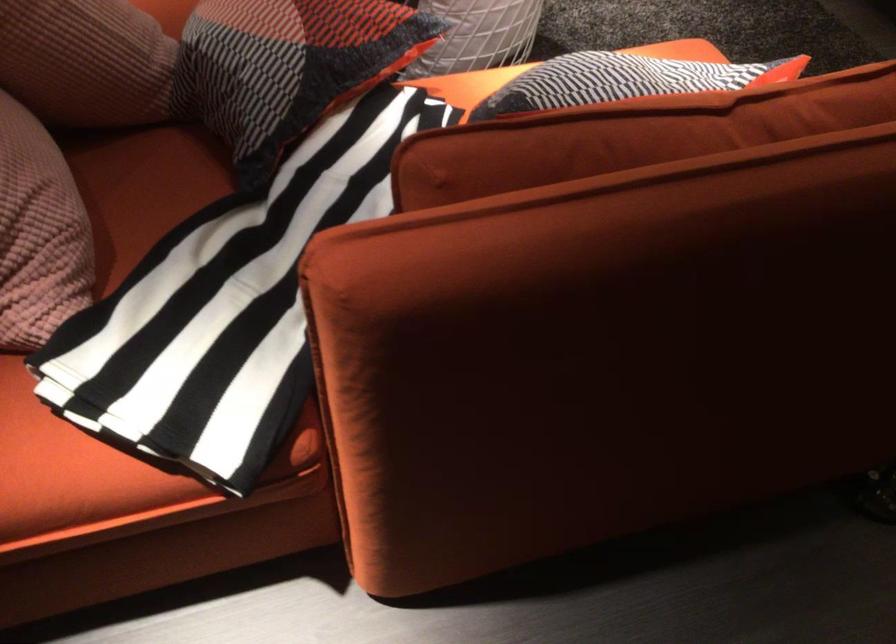
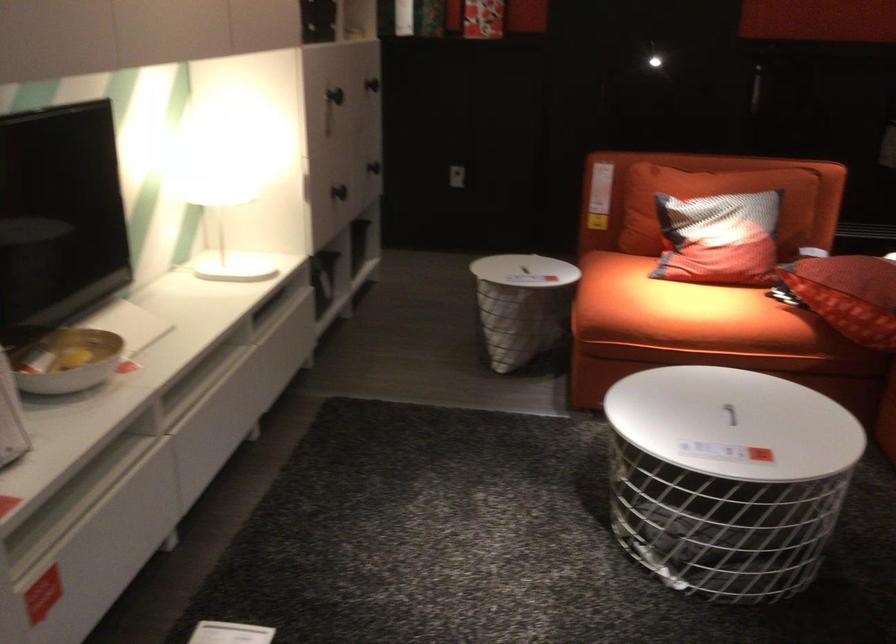
Question: I am providing you with two images of the same scene from different viewpoints. Which of the following objects are not visible in image2?

Choices:
 (A) white wire basket
 (B) black cabinet handle
 (C) white bowl
 (D) grey step stool

Answer: (A)